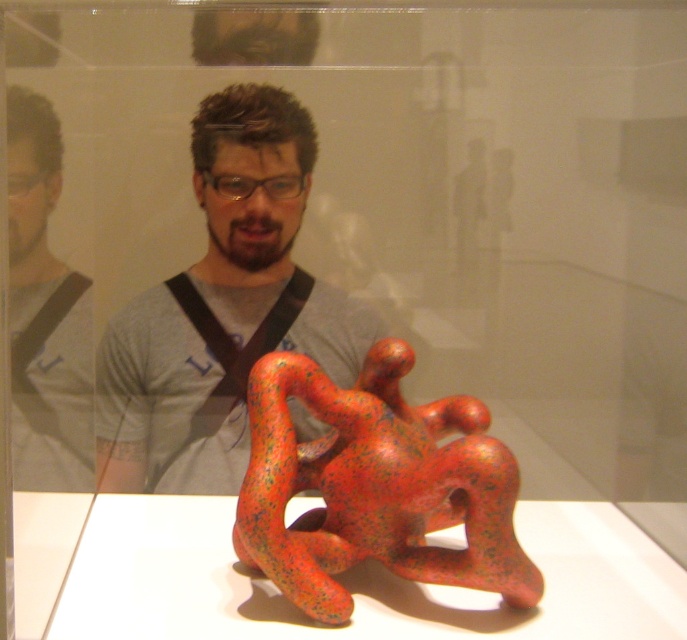
Question: Which object is closer to the camera taking this photo?

Choices:
 (A) matte gray shirt at left
 (B) matte gray shirt at center

Answer: (A)

Question: Considering the real-world distances, which object is closest to the speckled red sculpture at center?

Choices:
 (A) matte gray shirt at center
 (B) matte gray shirt at left

Answer: (A)

Question: Which point is closer to the camera?

Choices:
 (A) (245, 301)
 (B) (379, 419)
 (C) (78, 467)

Answer: (B)

Question: Is speckled red sculpture at center above matte gray shirt at left?

Choices:
 (A) no
 (B) yes

Answer: (A)

Question: Can you confirm if matte gray shirt at center is smaller than speckled red sculpture at center?

Choices:
 (A) no
 (B) yes

Answer: (B)

Question: Is matte gray shirt at center positioned behind matte gray shirt at left?

Choices:
 (A) yes
 (B) no

Answer: (A)